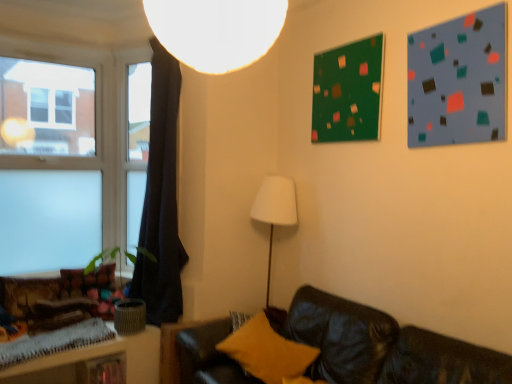
Question: From the image's perspective, would you say dark fabric curtain at left is positioned over yellow fuzzy pillow at lower center, positioned as the second pillow in back-to-front order?

Choices:
 (A) no
 (B) yes

Answer: (B)

Question: Is dark fabric curtain at left shorter than yellow fuzzy pillow at lower center, the second pillow from the left?

Choices:
 (A) no
 (B) yes

Answer: (A)

Question: Is dark fabric curtain at left positioned far away from yellow fuzzy pillow at lower center, marked as the 1th pillow in a right-to-left arrangement?

Choices:
 (A) yes
 (B) no

Answer: (B)

Question: Does dark fabric curtain at left have a greater width compared to yellow fuzzy pillow at lower center, positioned as the second pillow in back-to-front order?

Choices:
 (A) no
 (B) yes

Answer: (A)

Question: Does dark fabric curtain at left lie behind yellow fuzzy pillow at lower center, positioned as the first pillow in front-to-back order?

Choices:
 (A) no
 (B) yes

Answer: (B)

Question: From the image's perspective, is white matte lampshade at upper center above or below transparent glass window at left?

Choices:
 (A) above
 (B) below

Answer: (A)

Question: Considering the positions of white matte lampshade at upper center and transparent glass window at left in the image, is white matte lampshade at upper center wider or thinner than transparent glass window at left?

Choices:
 (A) thin
 (B) wide

Answer: (B)

Question: From a real-world perspective, is white matte lampshade at upper center above or below transparent glass window at left?

Choices:
 (A) below
 (B) above

Answer: (B)

Question: Considering their positions, is white matte lampshade at upper center located in front of or behind transparent glass window at left?

Choices:
 (A) behind
 (B) front

Answer: (B)

Question: Is transparent glass window at left bigger or smaller than yellow fuzzy pillow at lower center, positioned as the first pillow in front-to-back order?

Choices:
 (A) big
 (B) small

Answer: (A)

Question: From the image's perspective, is transparent glass window at left above or below yellow fuzzy pillow at lower center, marked as the 1th pillow in a right-to-left arrangement?

Choices:
 (A) below
 (B) above

Answer: (B)

Question: Based on their positions, is transparent glass window at left located to the left or right of yellow fuzzy pillow at lower center, marked as the 1th pillow in a right-to-left arrangement?

Choices:
 (A) right
 (B) left

Answer: (B)

Question: From their relative heights in the image, would you say transparent glass window at left is taller or shorter than yellow fuzzy pillow at lower center, positioned as the first pillow in front-to-back order?

Choices:
 (A) tall
 (B) short

Answer: (A)

Question: Looking at their shapes, would you say dark fabric curtain at left is wider or thinner than matte blue bulletin board at upper right, the 1th bulletin board viewed from the right?

Choices:
 (A) thin
 (B) wide

Answer: (B)

Question: From their relative heights in the image, would you say dark fabric curtain at left is taller or shorter than matte blue bulletin board at upper right, the second bulletin board in the back-to-front sequence?

Choices:
 (A) tall
 (B) short

Answer: (A)